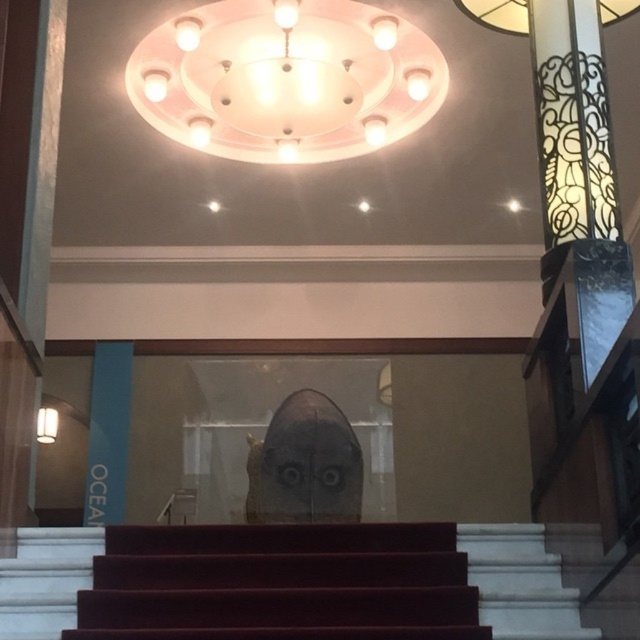
You are an interior designer planning to install a new lighting fixture in the gallery. The existing matte white chandelier at upper center and the white marble stairs at center are in your view. Which object is wider?

The matte white chandelier at upper center might be wider than white marble stairs at center according to the description provided.

You are standing at the entrance of the museum and see the maroon carpeted stairs at center and the matte white lampshade at left. Which object is positioned to the right side of the other?

The maroon carpeted stairs at center are to the right of the matte white lampshade at left.